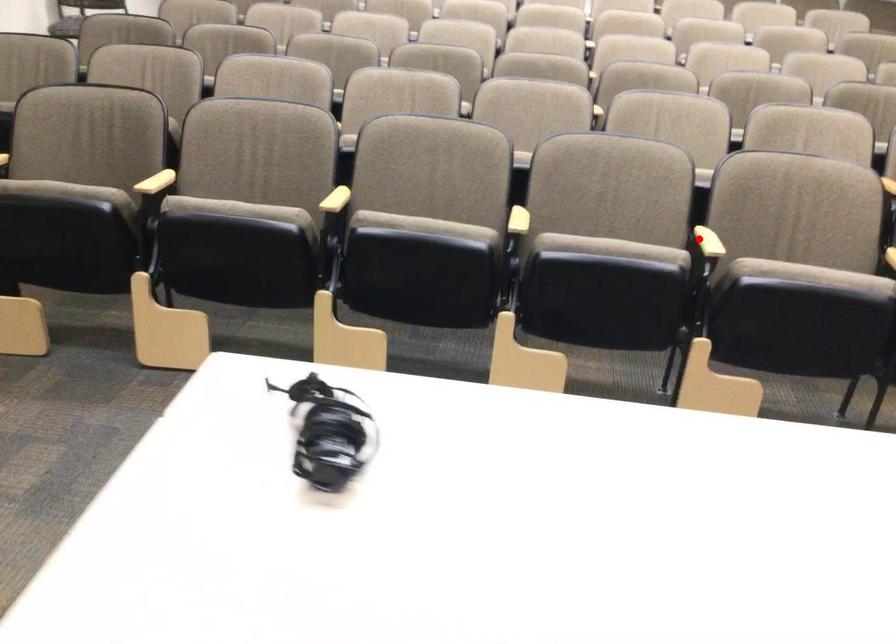
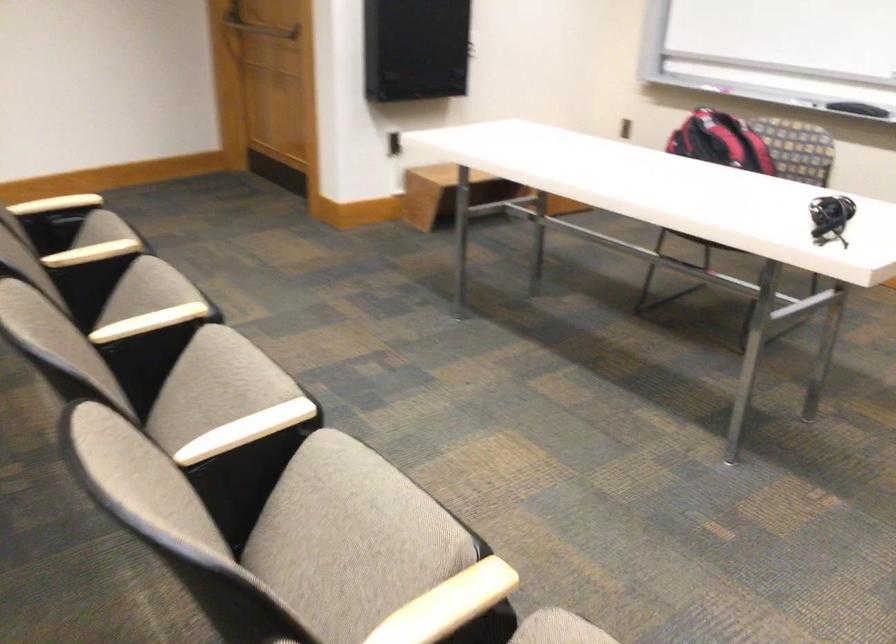
Question: I am providing you with two images of the same scene from different viewpoints. Given a red point in image1, look at the same physical point in image2. Is it:

Choices:
 (A) Closer to the viewpoint
 (B) Farther from the viewpoint

Answer: (A)